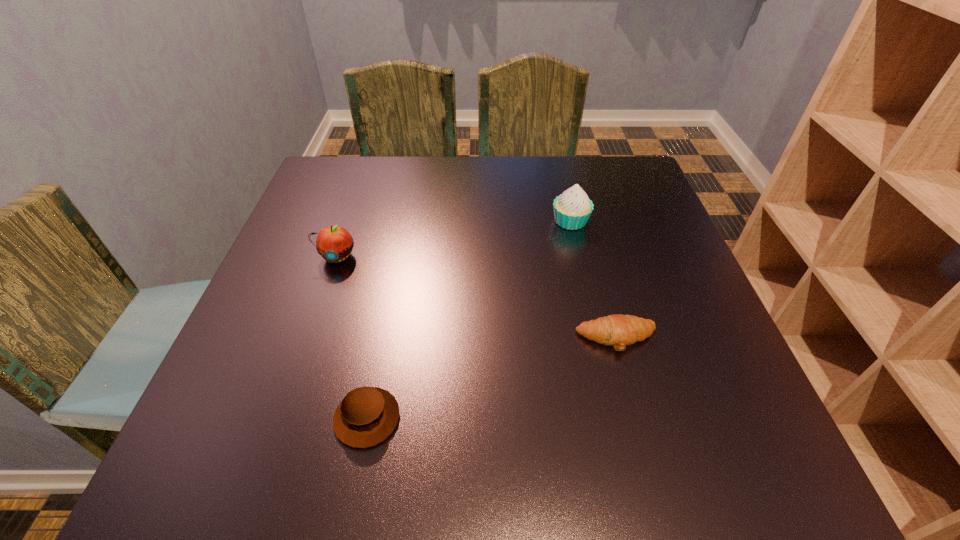
Locate an element on the screen. Image resolution: width=960 pixels, height=540 pixels. the farthest object is located at coordinates (572, 209).

In order to click on cupcake in this screenshot , I will do `click(572, 209)`.

Where is `the leftmost object`? the leftmost object is located at coordinates (334, 243).

You are a GUI agent. You are given a task and a screenshot of the screen. Output one action in this format:
    pyautogui.click(x=<x>, y=<y>)
    Task: Click on the third nearest object
    The image size is (960, 540).
    Given the screenshot: What is the action you would take?
    pyautogui.click(x=334, y=243)

Image resolution: width=960 pixels, height=540 pixels. In order to click on muffin in this screenshot , I will do `click(366, 416)`.

You are a GUI agent. You are given a task and a screenshot of the screen. Output one action in this format:
    pyautogui.click(x=<x>, y=<y>)
    Task: Click on the second shortest object
    The image size is (960, 540).
    Given the screenshot: What is the action you would take?
    pyautogui.click(x=366, y=416)

At what (x,y) coordinates should I click in order to perform the action: click on crescent roll. Please return your answer as a coordinate pair (x, y). The image size is (960, 540). Looking at the image, I should click on (619, 330).

Identify the location of the third farthest object. This screenshot has width=960, height=540. (619, 330).

This screenshot has width=960, height=540. I want to click on vacant space located on the left of the farthest object, so click(x=515, y=221).

You are a GUI agent. You are given a task and a screenshot of the screen. Output one action in this format:
    pyautogui.click(x=<x>, y=<y>)
    Task: Click on the vacant space situated on the back of the leftmost object
    The width and height of the screenshot is (960, 540).
    Given the screenshot: What is the action you would take?
    pyautogui.click(x=356, y=200)